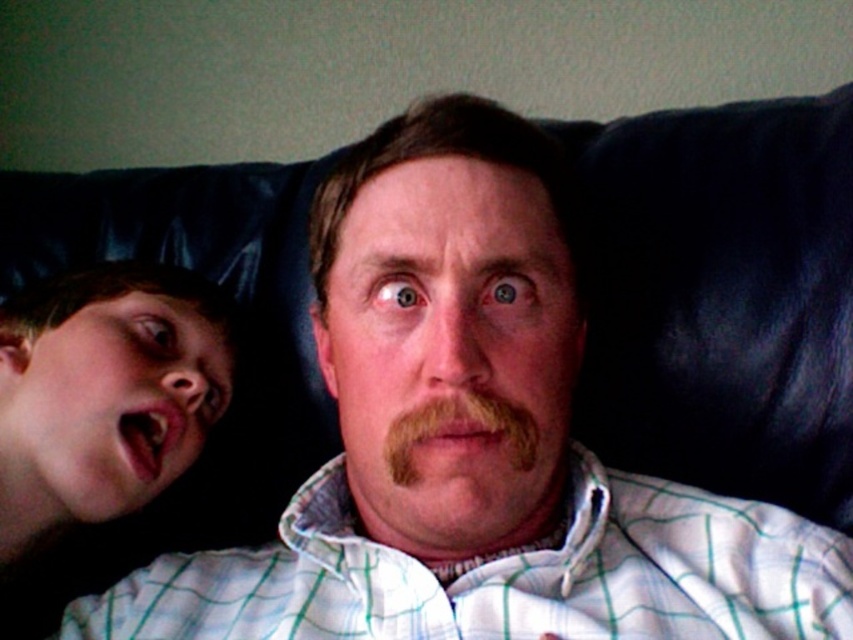
You are standing in a room with two points marked on the wall. The first point is at coordinates point (74, 317) and the second is at point (448, 403). If you are facing the wall, which point is closer to you?

Point (74, 317) is behind point (448, 403), so the point closer to you would be point (448, 403).

You are a photographer trying to capture a candid shot of the smooth skin face at left and the brown fuzzy mustache at center. Since you want both subjects in focus, which one should you adjust your camera focus to prioritize?

The smooth skin face at left is closer to the viewer than the brown fuzzy mustache at center, so you should prioritize focusing on the smooth skin face at left to ensure both are in focus.